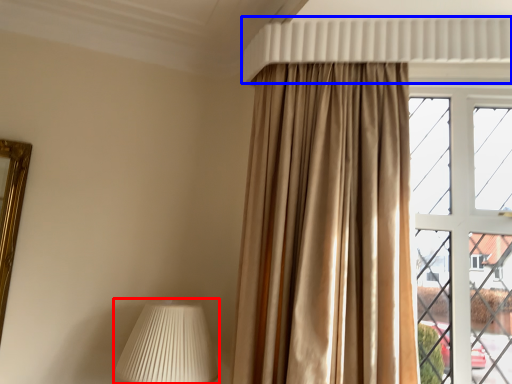
Question: Which of the following is the farthest to the observer, table lamp (highlighted by a red box) or shutter (highlighted by a blue box)?

Choices:
 (A) table lamp
 (B) shutter

Answer: (B)